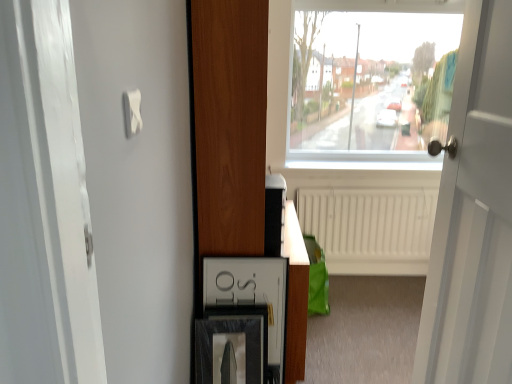
Question: Is white wooden door at right looking in the opposite direction of matte black medicine cabinet at lower center?

Choices:
 (A) yes
 (B) no

Answer: (B)

Question: Is white wooden door at right thinner than matte black medicine cabinet at lower center?

Choices:
 (A) yes
 (B) no

Answer: (B)

Question: Considering the relative sizes of white wooden door at right and matte black medicine cabinet at lower center in the image provided, is white wooden door at right taller than matte black medicine cabinet at lower center?

Choices:
 (A) no
 (B) yes

Answer: (B)

Question: Would you consider white wooden door at right to be distant from matte black medicine cabinet at lower center?

Choices:
 (A) yes
 (B) no

Answer: (B)

Question: Is the position of white wooden door at right less distant than that of matte black medicine cabinet at lower center?

Choices:
 (A) no
 (B) yes

Answer: (B)

Question: Would you say white glossy dresser at center is to the left or to the right of white matte radiator at center in the picture?

Choices:
 (A) right
 (B) left

Answer: (B)

Question: Looking at their shapes, would you say white glossy dresser at center is wider or thinner than white matte radiator at center?

Choices:
 (A) thin
 (B) wide

Answer: (B)

Question: Do you think white glossy dresser at center is within white matte radiator at center, or outside of it?

Choices:
 (A) outside
 (B) inside

Answer: (A)

Question: From the image's perspective, relative to white matte radiator at center, is white glossy dresser at center above or below?

Choices:
 (A) below
 (B) above

Answer: (B)

Question: In the image, is matte black medicine cabinet at lower center on the left side or the right side of white glossy dresser at center?

Choices:
 (A) right
 (B) left

Answer: (B)

Question: Is matte black medicine cabinet at lower center inside the boundaries of white glossy dresser at center, or outside?

Choices:
 (A) outside
 (B) inside

Answer: (B)

Question: From their relative heights in the image, would you say matte black medicine cabinet at lower center is taller or shorter than white glossy dresser at center?

Choices:
 (A) short
 (B) tall

Answer: (A)

Question: Considering the positions of point (266, 284) and point (304, 304), is point (266, 284) closer or farther from the camera than point (304, 304)?

Choices:
 (A) closer
 (B) farther

Answer: (A)

Question: Considering their positions, is white wooden door at right located in front of or behind matte black picture frame at lower center?

Choices:
 (A) front
 (B) behind

Answer: (A)

Question: In terms of height, does white wooden door at right look taller or shorter compared to matte black picture frame at lower center?

Choices:
 (A) tall
 (B) short

Answer: (A)